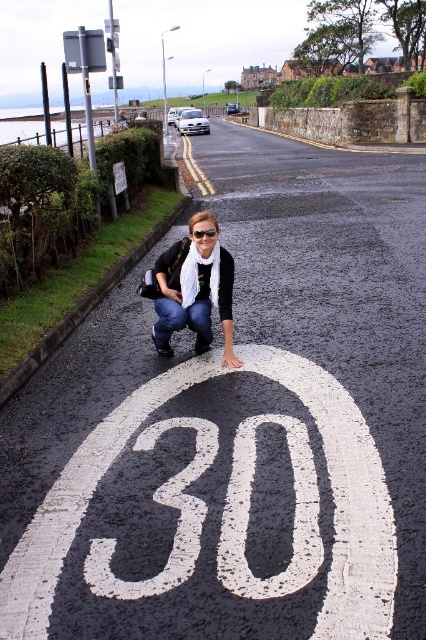
Consider the image. You are a delivery driver who needs to park your vehicle on the road where the white painted number at center is located. The parking space is exactly 10 feet long. Can your vehicle fit in the space if the vehicle is 8.92 feet long?

The parking space is 10 feet long, and the vehicle is 8.92 feet long. Since the vehicle is shorter than the parking space, it will fit comfortably within the white painted number at center area.

You are a photographer adjusting your equipment. You notice the matte black scarf at center and the black plastic goggles at center in the scene. Which object would you need to adjust your camera focus on first if you want to capture both clearly, considering their sizes?

The matte black scarf at center has a larger width than the black plastic goggles at center, so you should focus on the larger matte black scarf at center first to ensure both objects are in clear focus.

You are a delivery person carrying a large box that is 2 meters wide. You need to pass between the white painted number at center and the gray asphalt curb at lower left. Can you fit through the space between them?

The white painted number at center and gray asphalt curb at lower left are 2.32 meters apart from each other. Since your box is 2 meters wide, it should fit through the space as the distance is wider than the box.